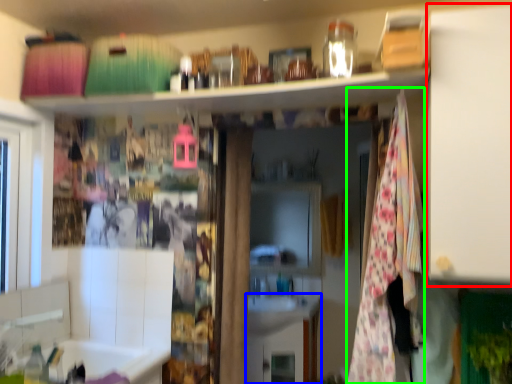
Question: Which object is the closest to the cabinet (highlighted by a red box)? Choose among these: cabinetry (highlighted by a blue box) or blanket (highlighted by a green box).

Choices:
 (A) cabinetry
 (B) blanket

Answer: (B)